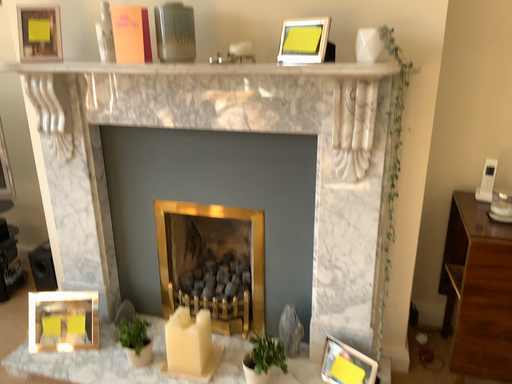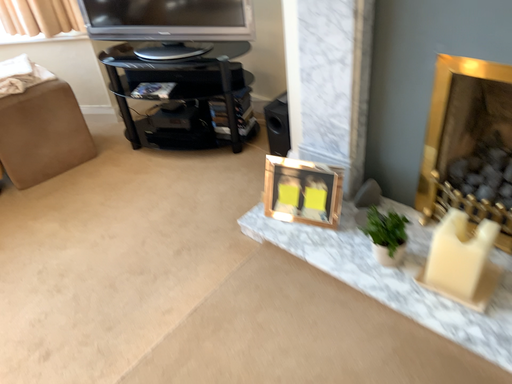
Question: How did the camera likely rotate when shooting the video?

Choices:
 (A) rotated right
 (B) rotated left

Answer: (B)